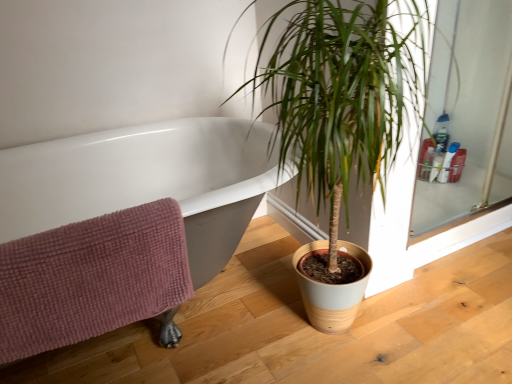
I want to click on vacant point to the right of green leafy plant at center, so click(x=462, y=310).